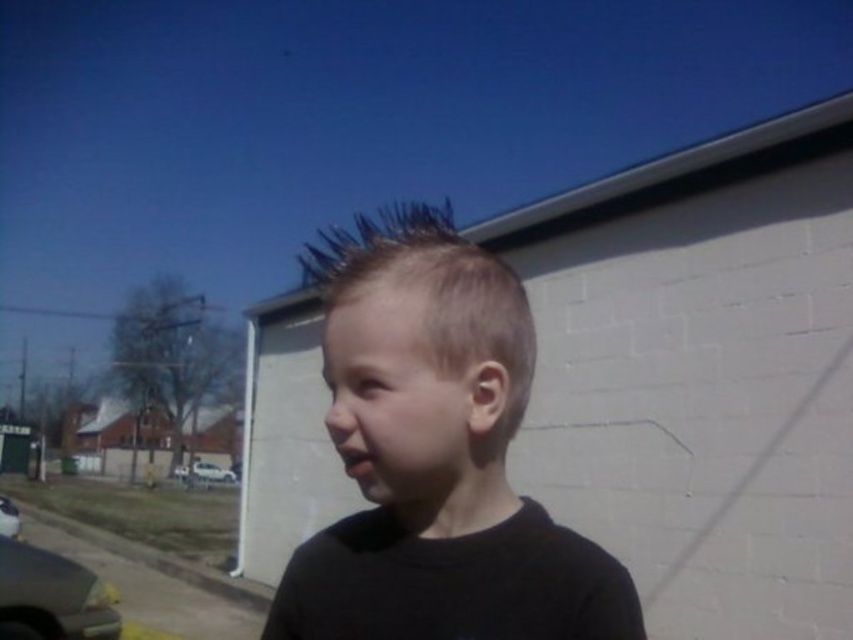
You are a photographer trying to capture the child and the car in the same frame. Based on the scene, can you determine if the silver metallic car at lower left is positioned below the blonde hair at center?

Yes, the silver metallic car at lower left is positioned below the blonde hair at center since the blonde hair at center is located above it.